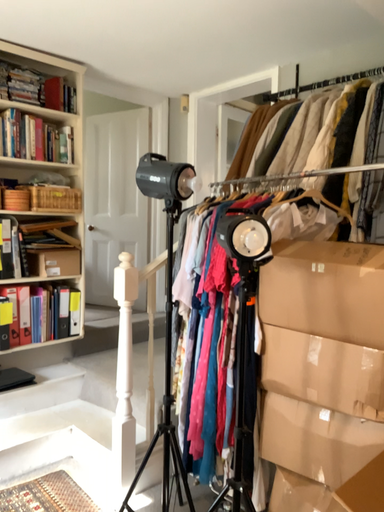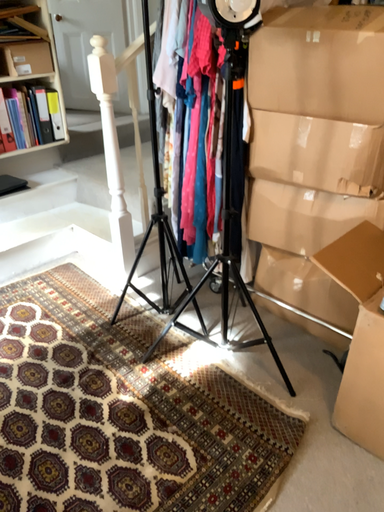
Question: Which way did the camera rotate in the video?

Choices:
 (A) rotated upward
 (B) rotated downward

Answer: (B)